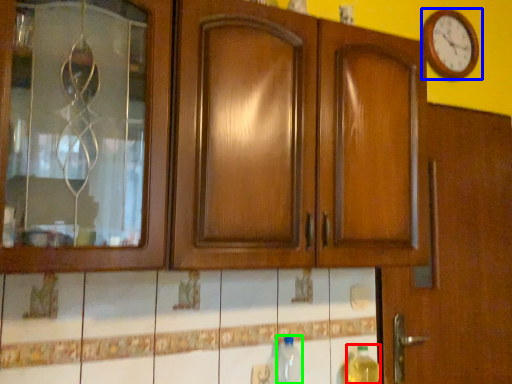
Question: Which object is the farthest from bottle (highlighted by a red box)? Choose among these: wall clock (highlighted by a blue box) or bottle (highlighted by a green box).

Choices:
 (A) wall clock
 (B) bottle

Answer: (A)